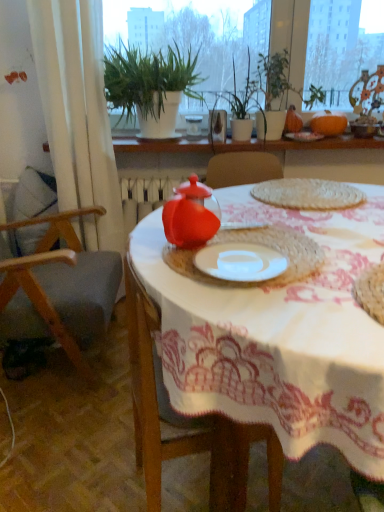
Question: Would you say white fabric curtain at left is to the left or to the right of green leafy plant at upper center in the picture?

Choices:
 (A) left
 (B) right

Answer: (A)

Question: Is white fabric curtain at left bigger or smaller than green leafy plant at upper center?

Choices:
 (A) small
 (B) big

Answer: (A)

Question: Estimate the real-world distances between objects in this image. Which object is closer to the white matte plate at center?

Choices:
 (A) woven mat at center
 (B) matte glass teapot at center, the first tableware in the back-to-front sequence
 (C) wooden chair at left
 (D) white fabric curtain at left
 (E) green matte plant at upper center

Answer: (A)

Question: Which of these objects is positioned farthest from the white textured plants at upper center?

Choices:
 (A) white matte plate at center
 (B) matte plastic teapot at center, which is counted as the 1th tableware, starting from the left
 (C) green leafy plant at upper center
 (D) green leafy plants at upper center
 (E) white fabric curtain at left

Answer: (A)